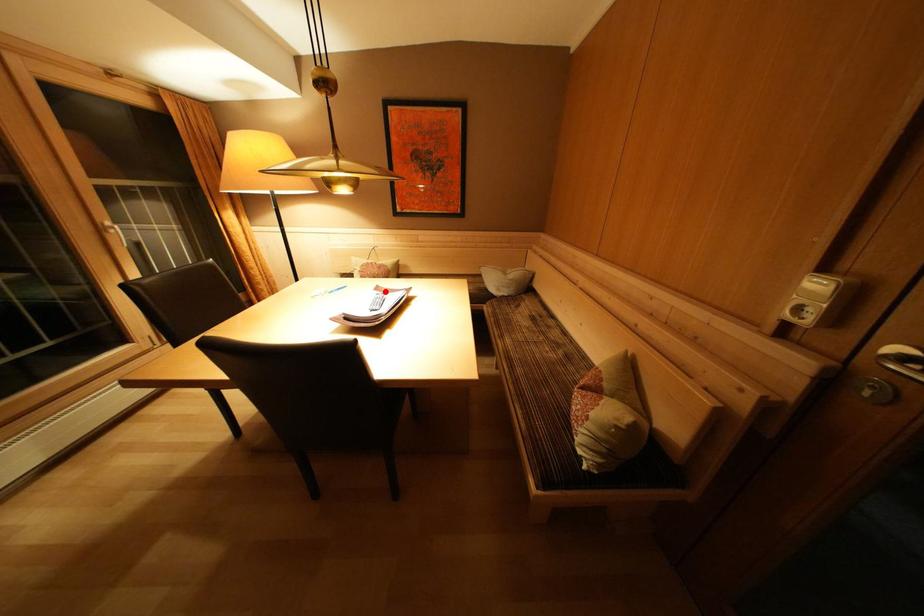
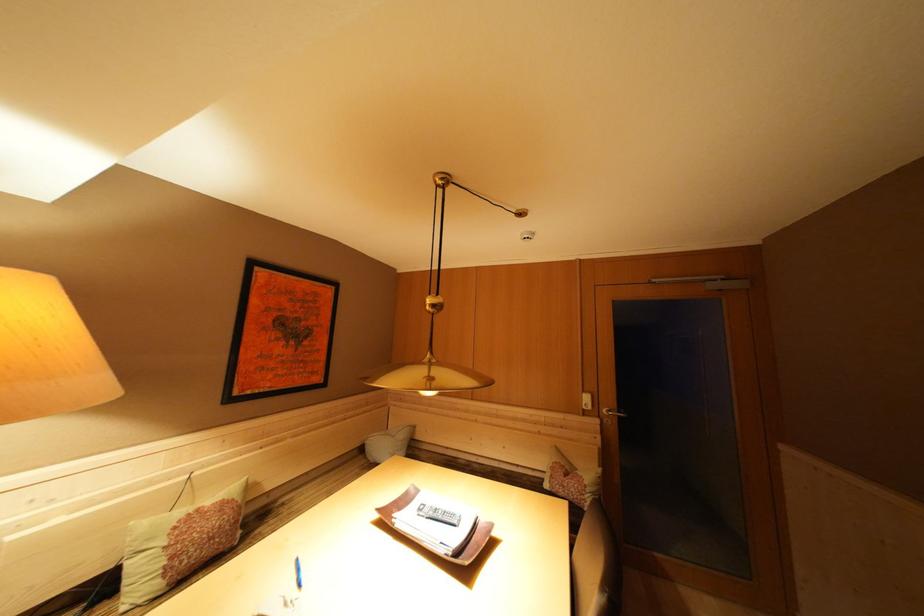
Locate, in the second image, the point that corresponds to the highlighted location in the first image.

(384, 515)